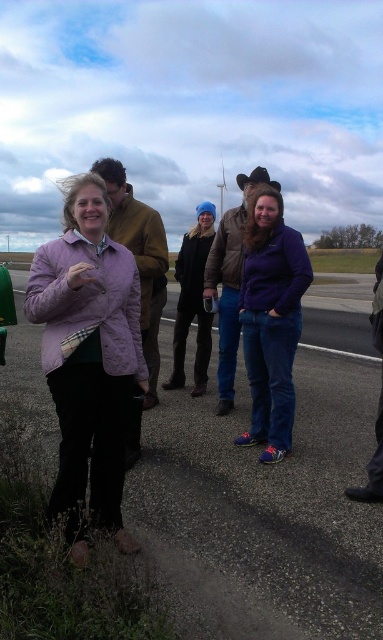
Who is shorter, smooth asphalt road at center or purple matte jacket at center?

smooth asphalt road at center is shorter.

Between smooth asphalt road at center and purple matte jacket at center, which one appears on the left side from the viewer's perspective?

smooth asphalt road at center

This screenshot has width=383, height=640. What do you see at coordinates (266, 509) in the screenshot?
I see `smooth asphalt road at center` at bounding box center [266, 509].

Find the location of a particular element. Image resolution: width=383 pixels, height=640 pixels. smooth asphalt road at center is located at coordinates (266, 509).

Between point (302, 449) and point (32, 308), which one is positioned behind?

Positioned behind is point (302, 449).

Is smooth asphalt road at center further to camera compared to matte purple jacket at center?

No, it is in front of matte purple jacket at center.

You are a GUI agent. You are given a task and a screenshot of the screen. Output one action in this format:
    pyautogui.click(x=<x>, y=<y>)
    Task: Click on the smooth asphalt road at center
    The height and width of the screenshot is (640, 383).
    Given the screenshot: What is the action you would take?
    pyautogui.click(x=266, y=509)

Identify the location of smooth asphalt road at center. pyautogui.click(x=266, y=509).

Does matte purple jacket at center come in front of purple matte jacket at center?

Yes, it is in front of purple matte jacket at center.

Locate an element on the screen. matte purple jacket at center is located at coordinates (88, 353).

Between point (57, 506) and point (273, 228), which one is positioned behind?

Positioned behind is point (273, 228).

Where is `matte purple jacket at center`? The width and height of the screenshot is (383, 640). matte purple jacket at center is located at coordinates (88, 353).